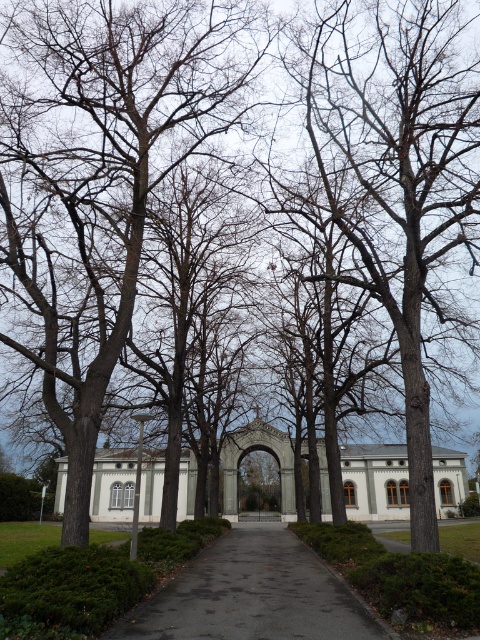
Question: Does bare wood tree at center appear on the right side of dark asphalt path at center?

Choices:
 (A) no
 (B) yes

Answer: (B)

Question: Is bare wood tree at center smaller than dark asphalt path at center?

Choices:
 (A) yes
 (B) no

Answer: (B)

Question: Among these objects, which one is nearest to the camera?

Choices:
 (A) bare wood tree at center
 (B) dark asphalt path at center

Answer: (B)

Question: Which of the following is the farthest from the observer?

Choices:
 (A) (210, 557)
 (B) (422, 6)

Answer: (A)

Question: Can you confirm if bare wood tree at center is positioned below dark asphalt path at center?

Choices:
 (A) yes
 (B) no

Answer: (B)